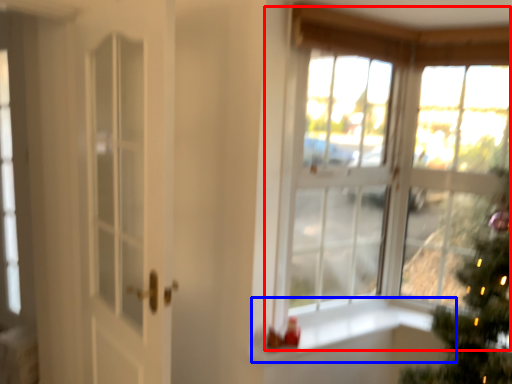
Question: Which point is closer to the camera, window (highlighted by a red box) or window sill (highlighted by a blue box)?

Choices:
 (A) window
 (B) window sill

Answer: (A)